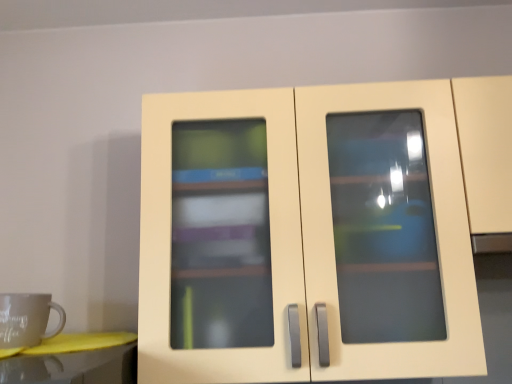
In order to face matte cream cupboard at center, should I rotate leftwards or rightwards?

A 13.821 degree turn to the right will do.

Where is `matte cream cupboard at center`? matte cream cupboard at center is located at coordinates (305, 237).

The width and height of the screenshot is (512, 384). Describe the element at coordinates (305, 237) in the screenshot. I see `matte cream cupboard at center` at that location.

The height and width of the screenshot is (384, 512). What do you see at coordinates (26, 319) in the screenshot?
I see `matte gray mug at left` at bounding box center [26, 319].

Where is `matte gray mug at left`? matte gray mug at left is located at coordinates (26, 319).

What is the approximate width of matte gray mug at left?

It is 4.84 inches.

Find the location of `matte cream cupboard at center`. matte cream cupboard at center is located at coordinates (305, 237).

Based on their positions, is matte gray mug at left located to the left or right of matte cream cupboard at center?

In the image, matte gray mug at left appears on the left side of matte cream cupboard at center.

In the scene shown: Considering the relative positions of matte gray mug at left and matte cream cupboard at center in the image provided, is matte gray mug at left behind matte cream cupboard at center?

That is True.

Considering the points (6, 315) and (476, 295), which point is in front, point (6, 315) or point (476, 295)?

The point (6, 315) is closer.

From the image's perspective, does matte gray mug at left appear higher than matte cream cupboard at center?

Incorrect, from the image's perspective, matte gray mug at left is lower than matte cream cupboard at center.

From a real-world perspective, who is located lower, matte gray mug at left or matte cream cupboard at center?

matte gray mug at left is physically lower.

Considering the sizes of objects matte gray mug at left and matte cream cupboard at center in the image provided, who is wider, matte gray mug at left or matte cream cupboard at center?

With larger width is matte cream cupboard at center.

Between matte gray mug at left and matte cream cupboard at center, which one has more height?

With more height is matte cream cupboard at center.

Between matte gray mug at left and matte cream cupboard at center, which one has smaller size?

matte gray mug at left is smaller.

Is matte gray mug at left situated inside matte cream cupboard at center or outside?

matte gray mug at left is located beyond the bounds of matte cream cupboard at center.

Is matte gray mug at left next to matte cream cupboard at center and touching it?

No, matte gray mug at left is not making contact with matte cream cupboard at center.

Is matte gray mug at left facing towards matte cream cupboard at center?

No, matte gray mug at left is not aimed at matte cream cupboard at center.

Identify the location of cupboard on the right of matte gray mug at left. (305, 237).

Which is more to the left, matte cream cupboard at center or matte gray mug at left?

Positioned to the left is matte gray mug at left.

Which object is further away from the camera taking this photo, matte cream cupboard at center or matte gray mug at left?

matte gray mug at left is further away from the camera.

Which is less distant, (336,289) or (1,341)?

Point (336,289) appears to be farther away from the viewer than point (1,341).

From the image's perspective, which is above, matte cream cupboard at center or matte gray mug at left?

From the image's view, matte cream cupboard at center is above.

Consider the image. From a real-world perspective, is matte cream cupboard at center under matte gray mug at left?

No, from a real-world perspective, matte cream cupboard at center is not under matte gray mug at left.

Considering the sizes of objects matte cream cupboard at center and matte gray mug at left in the image provided, who is wider, matte cream cupboard at center or matte gray mug at left?

matte cream cupboard at center.

Considering the sizes of matte cream cupboard at center and matte gray mug at left in the image, is matte cream cupboard at center taller or shorter than matte gray mug at left?

matte cream cupboard at center is taller than matte gray mug at left.

Who is smaller, matte cream cupboard at center or matte gray mug at left?

matte gray mug at left is smaller.

Is matte gray mug at left completely or partially inside matte cream cupboard at center?

No, matte gray mug at left is located outside of matte cream cupboard at center.

Is matte cream cupboard at center not close to matte gray mug at left?

No, matte cream cupboard at center is in close proximity to matte gray mug at left.

Is matte cream cupboard at center oriented away from matte gray mug at left?

No, matte cream cupboard at center is not facing away from matte gray mug at left.

Can you tell me how much matte cream cupboard at center and matte gray mug at left differ in facing direction?

2.51 degrees separate the facing orientations of matte cream cupboard at center and matte gray mug at left.

The height and width of the screenshot is (384, 512). What are the coordinates of `cupboard located above the matte gray mug at left (from the image's perspective)` in the screenshot? It's located at (305, 237).

Identify the location of mug that appears on the left of matte cream cupboard at center. (26, 319).

Find the location of `cupboard in front of the matte gray mug at left`. cupboard in front of the matte gray mug at left is located at coordinates (305, 237).